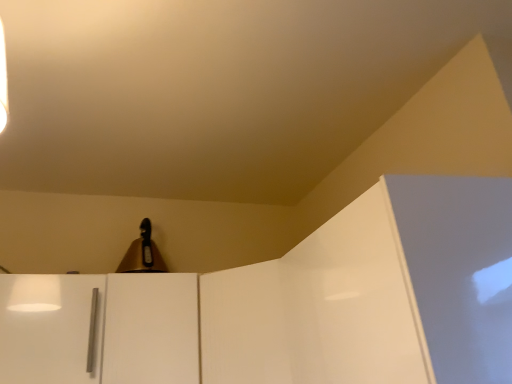
Question: From the image's perspective, is white glossy door at center beneath white matte cabinet handle at lower left?

Choices:
 (A) yes
 (B) no

Answer: (A)

Question: Would you say white matte cabinet handle at lower left is part of white glossy door at center's contents?

Choices:
 (A) no
 (B) yes

Answer: (A)

Question: Considering the relative positions of white glossy door at center and white matte cabinet handle at lower left in the image provided, is white glossy door at center to the left of white matte cabinet handle at lower left from the viewer's perspective?

Choices:
 (A) no
 (B) yes

Answer: (A)

Question: Considering the relative positions of white glossy door at center and white matte cabinet handle at lower left in the image provided, is white glossy door at center behind white matte cabinet handle at lower left?

Choices:
 (A) yes
 (B) no

Answer: (A)

Question: Considering the relative sizes of white glossy door at center and white matte cabinet handle at lower left in the image provided, is white glossy door at center bigger than white matte cabinet handle at lower left?

Choices:
 (A) no
 (B) yes

Answer: (B)

Question: Is white glossy door at center outside white matte cabinet handle at lower left?

Choices:
 (A) no
 (B) yes

Answer: (B)

Question: Is gold metallic bell at upper center shorter than white glossy door at center?

Choices:
 (A) no
 (B) yes

Answer: (B)

Question: From the image's perspective, is gold metallic bell at upper center under white glossy door at center?

Choices:
 (A) yes
 (B) no

Answer: (B)

Question: Could you tell me if gold metallic bell at upper center is facing white glossy door at center?

Choices:
 (A) yes
 (B) no

Answer: (B)

Question: Does gold metallic bell at upper center appear on the right side of white glossy door at center?

Choices:
 (A) no
 (B) yes

Answer: (A)

Question: From a real-world perspective, does gold metallic bell at upper center stand above white glossy door at center?

Choices:
 (A) no
 (B) yes

Answer: (B)

Question: Considering the relative positions of gold metallic bell at upper center and white glossy door at center in the image provided, is gold metallic bell at upper center behind white glossy door at center?

Choices:
 (A) no
 (B) yes

Answer: (B)

Question: Is white glossy door at center facing towards gold metallic bell at upper center?

Choices:
 (A) yes
 (B) no

Answer: (B)